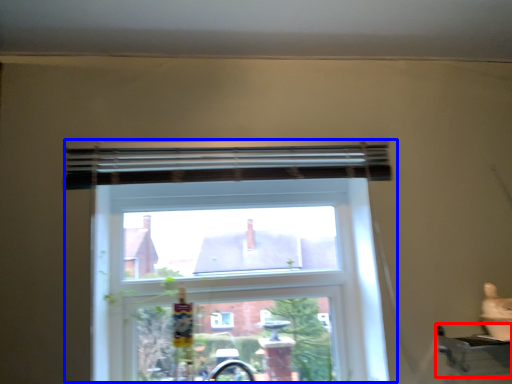
Question: Which point is closer to the camera, window sill (highlighted by a red box) or window (highlighted by a blue box)?

Choices:
 (A) window sill
 (B) window

Answer: (A)